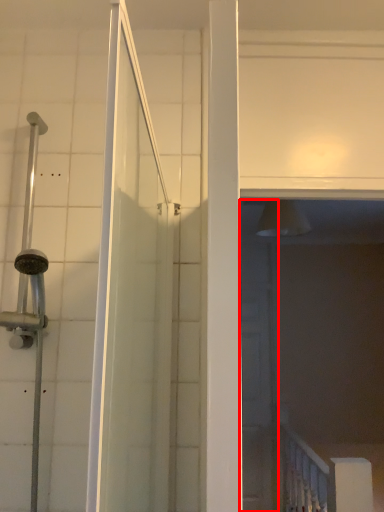
Question: Where is screen door (annotated by the red box) located in relation to rail in the image?

Choices:
 (A) right
 (B) left

Answer: (B)